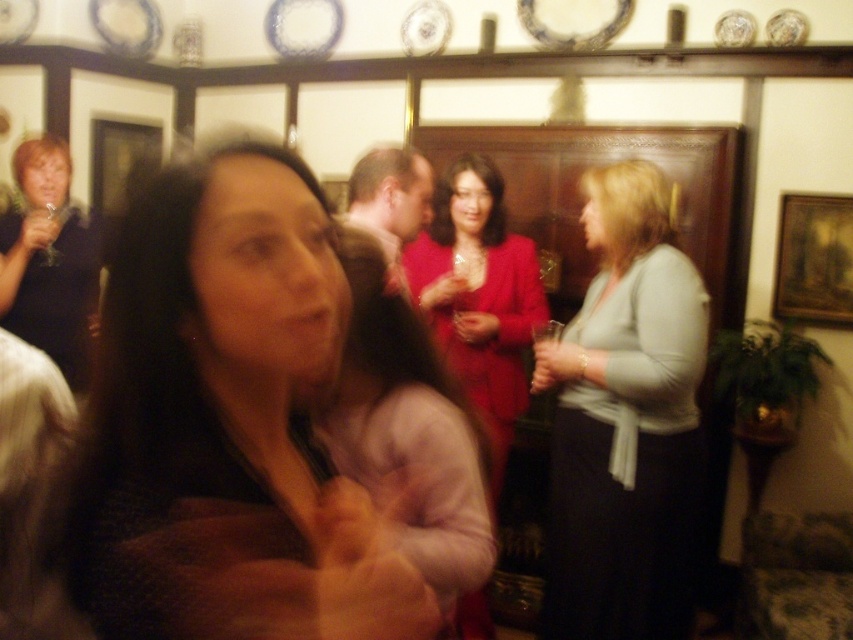
Consider the image. You are at a party and see the matte pink sweater at center and the wooden framed painting at upper right. Which object is taller?

The matte pink sweater at center is much taller than the wooden framed painting at upper right.

You are planning to hang a new picture on the wall between the matte red dress at center and the wooden framed painting at upper right. Given that the distance between them is 4.52 feet, can you estimate if there will be enough space to place the new picture without overlapping either object?

The distance between the matte red dress at center and the wooden framed painting at upper right is 4.52 feet. Assuming the new picture requires a standard frame size, there should be sufficient space to place it between them without overlapping either object.

You are at a party and want to take a photo of the light gray sweater at center and the matte red dress at center. Which one will appear larger in the photo?

The light gray sweater at center appears larger in the photo because it is positioned under the matte red dress at center, meaning it is closer to the camera.